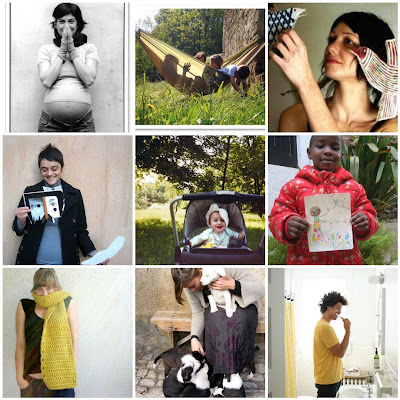
Identify the location of photo on edge of collage array. Image resolution: width=400 pixels, height=400 pixels. (90, 338), (199, 327), (329, 326), (329, 202), (324, 120), (220, 102), (97, 102), (83, 181).